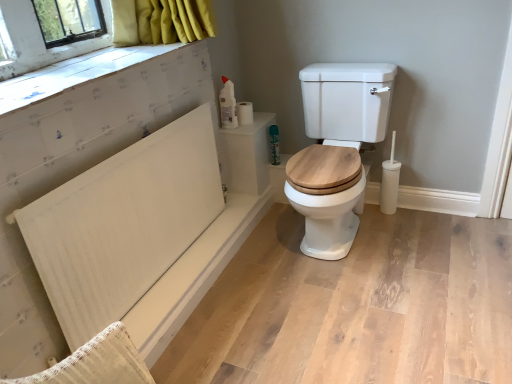
The height and width of the screenshot is (384, 512). What are the coordinates of `vacant space situated on the left part of white wood toilet at center` in the screenshot? It's located at (262, 252).